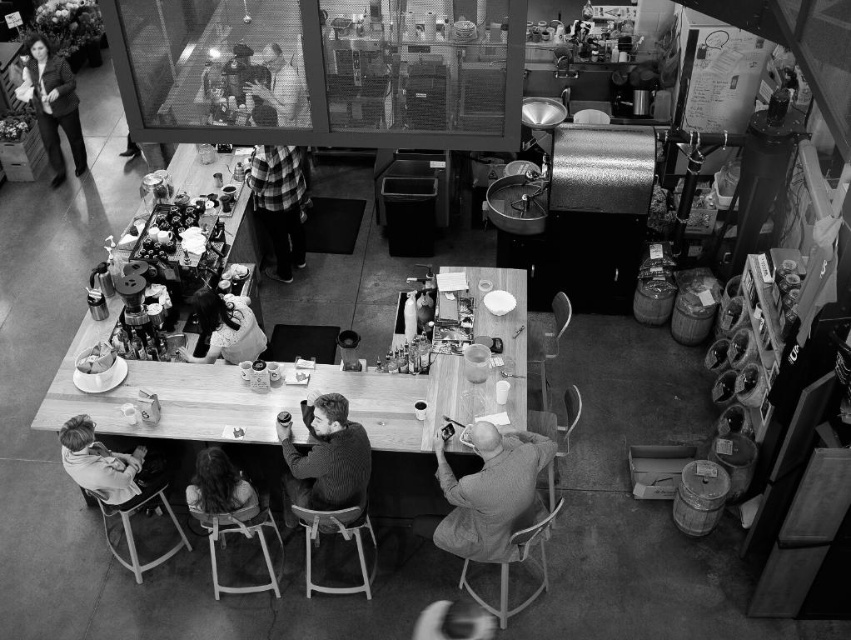
Question: Which of the following is the farthest from the observer?

Choices:
 (A) knitted sweater at center
 (B) light brown leather jacket at lower left

Answer: (B)

Question: Considering the relative positions of smooth gray sweater at center and matte black jacket at upper left in the image provided, where is smooth gray sweater at center located with respect to matte black jacket at upper left?

Choices:
 (A) above
 (B) below

Answer: (B)

Question: Is matte black jacket at upper left above smooth white plate at lower center?

Choices:
 (A) no
 (B) yes

Answer: (B)

Question: Which object is closer to the camera taking this photo?

Choices:
 (A) long hair at lower center
 (B) checkered fabric shirt at center
 (C) light brown leather jacket at lower left

Answer: (A)

Question: From the image, what is the correct spatial relationship of matte black jacket at upper left in relation to smooth white plate at lower center?

Choices:
 (A) above
 (B) below

Answer: (A)

Question: Which object is the closest to the smooth leather jacket at center?

Choices:
 (A) long hair at lower center
 (B) smooth gray sweater at center
 (C) checkered fabric shirt at center
 (D) matte black jacket at upper left

Answer: (A)